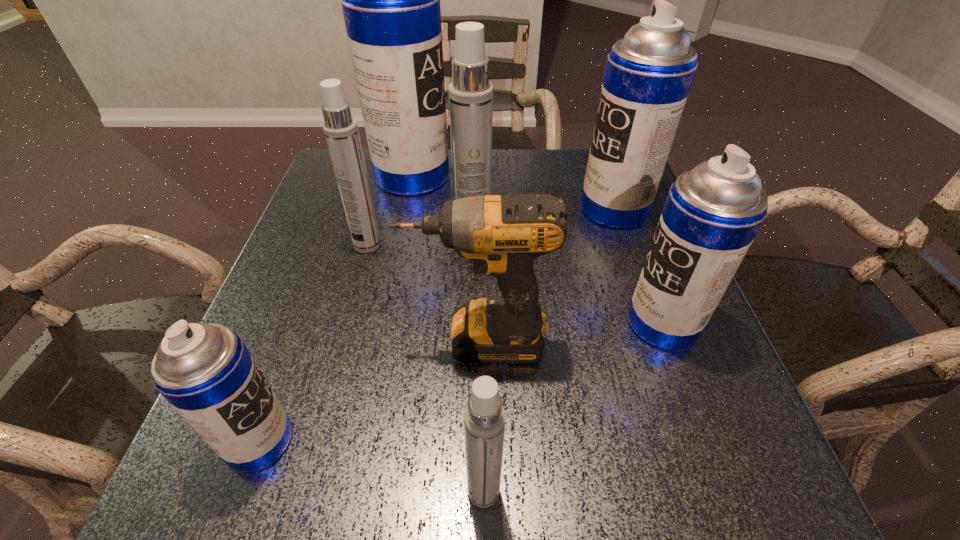
The image size is (960, 540). In order to click on vacant point at the near edge in this screenshot , I will do `click(319, 488)`.

Locate an element on the screen. The height and width of the screenshot is (540, 960). free spot at the left edge of the desktop is located at coordinates (297, 253).

The width and height of the screenshot is (960, 540). I want to click on vacant region at the right edge of the desktop, so click(x=729, y=442).

This screenshot has height=540, width=960. In the image, there is a desktop. In order to click on free space at the near left corner in this screenshot , I will do `click(292, 490)`.

At what (x,y) coordinates should I click in order to perform the action: click on vacant space that's between the nearest object and the fifth farthest aerosol can. Please return your answer as a coordinate pair (x, y). Looking at the image, I should click on 573,407.

This screenshot has width=960, height=540. Find the location of `free point between the drill and the third biggest blue aerosol can`. free point between the drill and the third biggest blue aerosol can is located at coordinates (570, 331).

The image size is (960, 540). I want to click on blank region between the fifth farthest aerosol can and the nearest aerosol can, so click(x=573, y=407).

I want to click on free space between the third nearest aerosol can and the drill, so click(570, 331).

This screenshot has height=540, width=960. In order to click on free space between the nearest aerosol can and the leftmost aerosol can in this screenshot , I will do `click(372, 465)`.

Image resolution: width=960 pixels, height=540 pixels. What are the coordinates of `empty space that is in between the third farthest blue aerosol can and the drill` in the screenshot? It's located at (570, 331).